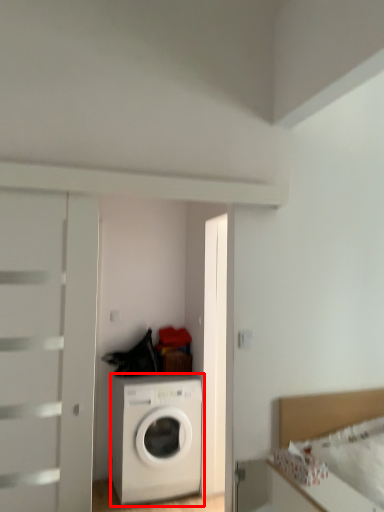
Question: From the image, what is the correct spatial relationship of washing machine (annotated by the red box) in relation to bed?

Choices:
 (A) right
 (B) left

Answer: (B)